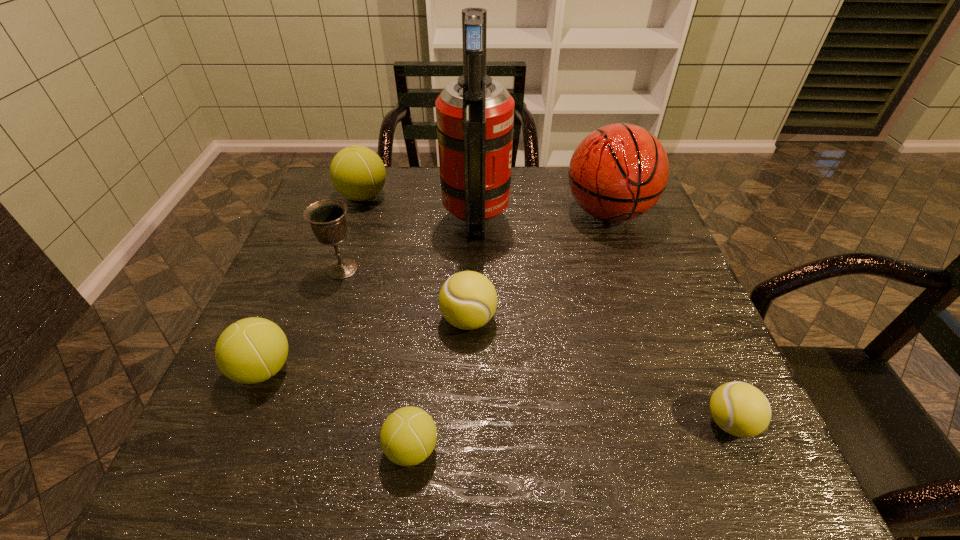
I want to click on object that is at the far right corner, so click(618, 172).

The width and height of the screenshot is (960, 540). In order to click on object situated at the near right corner in this screenshot , I will do `click(740, 409)`.

Locate an element on the screen. free space at the far edge is located at coordinates (524, 201).

Locate an element on the screen. The image size is (960, 540). free space at the left edge is located at coordinates (307, 392).

At what (x,y) coordinates should I click in order to perform the action: click on blank space at the right edge of the desktop. Please return your answer as a coordinate pair (x, y). The image size is (960, 540). Looking at the image, I should click on (636, 298).

This screenshot has width=960, height=540. In order to click on vacant space at the near right corner in this screenshot , I will do `click(714, 481)`.

What are the coordinates of `vacant space that's between the smaller yellow tennis ball and the second farthest green tennis ball` in the screenshot? It's located at (496, 396).

Locate an element on the screen. free spot between the second farthest green tennis ball and the smallest green tennis ball is located at coordinates (338, 409).

This screenshot has height=540, width=960. Identify the location of free area in between the second tallest object and the chalice. (475, 241).

Image resolution: width=960 pixels, height=540 pixels. In order to click on free spot between the third nearest tennis ball and the rightmost tennis ball in this screenshot , I will do `click(496, 396)`.